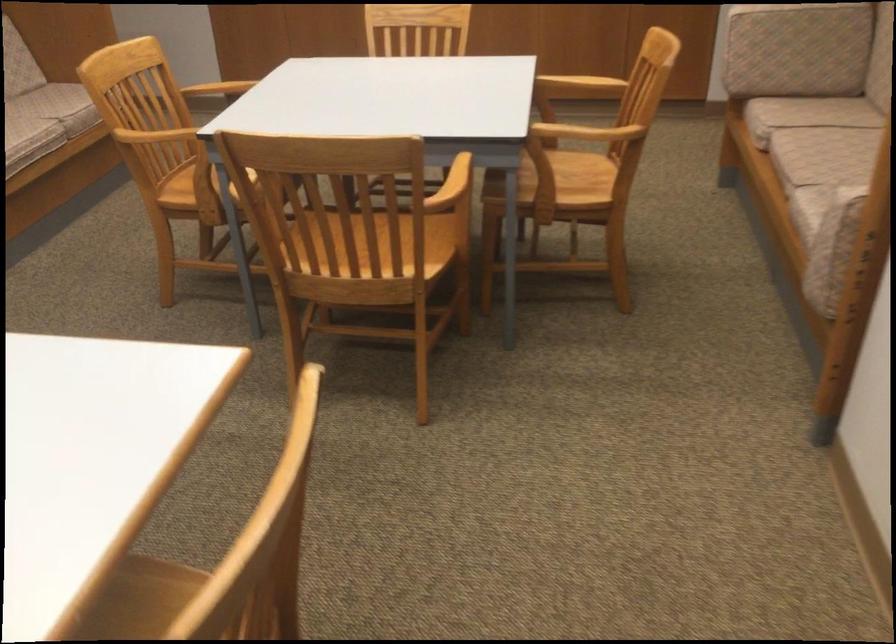
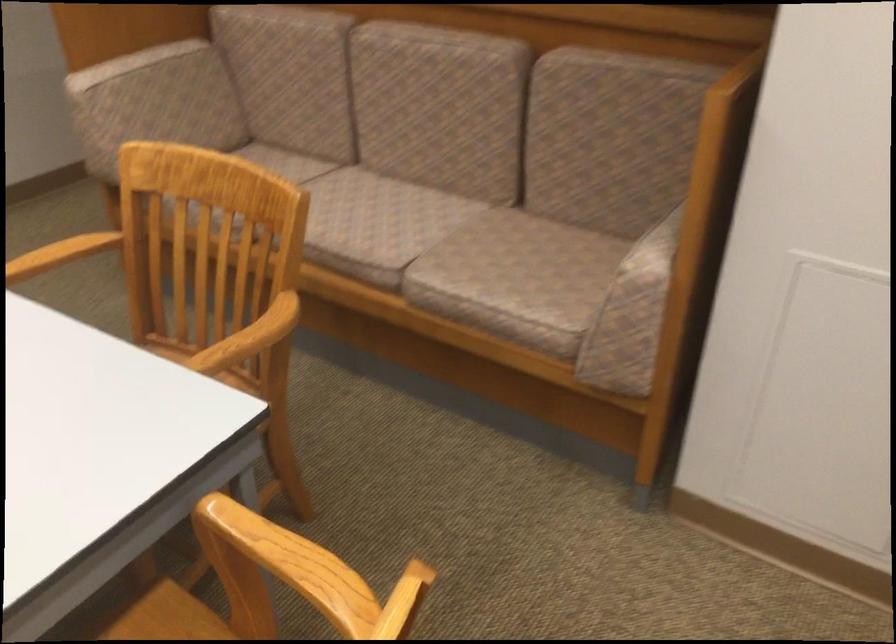
Question: I am providing you with two images of the same scene from different viewpoints. After the viewpoint changes to image2, which objects are now occluded?

Choices:
 (A) wooden chair armrest
 (B) hanger hook
 (C) sofa sitting surface
 (D) upholstered sofa sitting surface

Answer: (C)